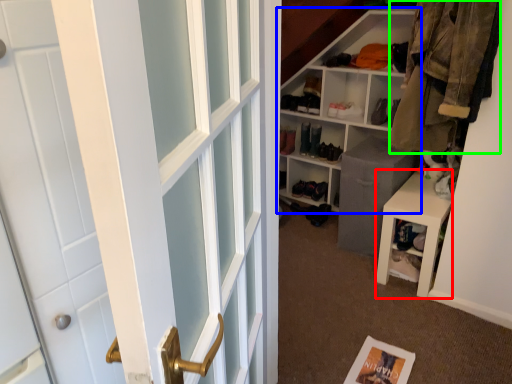
Question: Estimate the real-world distances between objects in this image. Which object is farther from stool (highlighted by a red box), shelf (highlighted by a blue box) or clothing (highlighted by a green box)?

Choices:
 (A) shelf
 (B) clothing

Answer: (A)